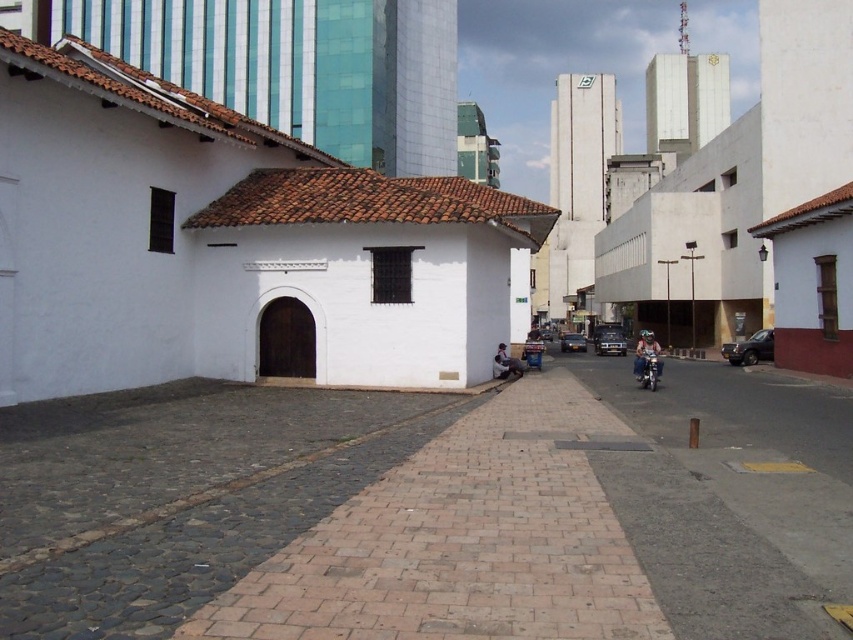
Question: Considering the relative positions of shiny black car at right and shiny blue helmet at center in the image provided, where is shiny black car at right located with respect to shiny blue helmet at center?

Choices:
 (A) left
 (B) right

Answer: (B)

Question: Is shiny black car at right below metallic silver car at center-right?

Choices:
 (A) no
 (B) yes

Answer: (B)

Question: Does metallic silver car at center-right have a greater width compared to dark skin person at center?

Choices:
 (A) yes
 (B) no

Answer: (A)

Question: Which object appears closest to the camera in this image?

Choices:
 (A) shiny blue helmet at center
 (B) shiny black car at right
 (C) shiny blue motorcycle at center-right
 (D) metallic silver car at center-right

Answer: (C)

Question: Which point is farther from the camera taking this photo?

Choices:
 (A) (532, 332)
 (B) (505, 352)

Answer: (A)

Question: Which object appears closest to the camera in this image?

Choices:
 (A) shiny blue helmet at center
 (B) metallic silver sedan at center
 (C) shiny blue motorcycle at center-right
 (D) metallic silver car at center-right

Answer: (C)